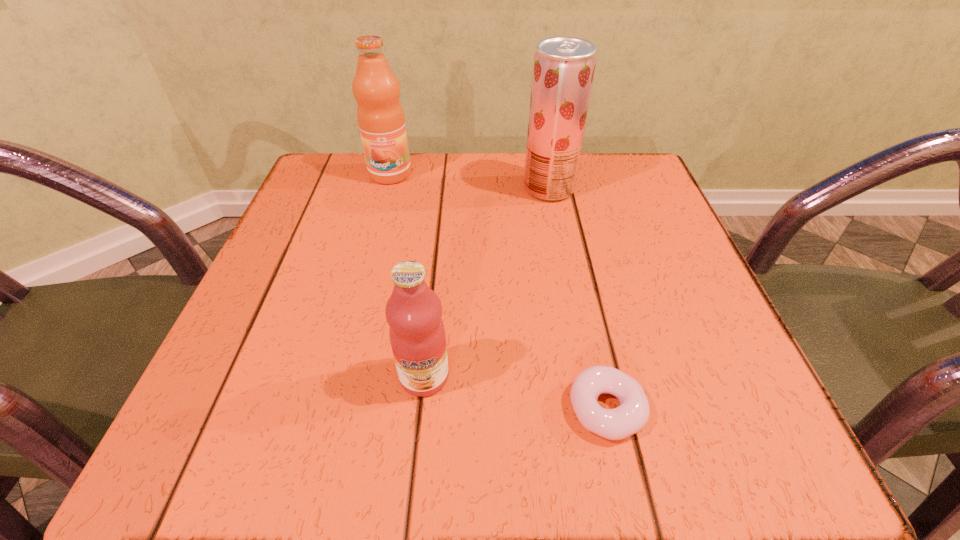
Locate which object is the second closest to the third tallest object. Please provide its 2D coordinates. Your answer should be formatted as a tuple, i.e. [(x, y)], where the tuple contains the x and y coordinates of a point satisfying the conditions above.

[(563, 68)]

At what (x,y) coordinates should I click in order to perform the action: click on object that is the closest one to the rightmost fruit juice. Please return your answer as a coordinate pair (x, y). This screenshot has height=540, width=960. Looking at the image, I should click on click(x=380, y=115).

Select which fruit juice appears as the closest to the shortest object. Please provide its 2D coordinates. Your answer should be formatted as a tuple, i.e. [(x, y)], where the tuple contains the x and y coordinates of a point satisfying the conditions above.

[(417, 334)]

Identify which fruit juice is the third closest to the shortest object. Please provide its 2D coordinates. Your answer should be formatted as a tuple, i.e. [(x, y)], where the tuple contains the x and y coordinates of a point satisfying the conditions above.

[(380, 115)]

The height and width of the screenshot is (540, 960). Identify the location of vacant space that satisfies the following two spatial constraints: 1. on the label side of the leftmost fruit juice; 2. on the right side of the rightmost fruit juice. (386, 188).

Locate an element on the screen. free spot that satisfies the following two spatial constraints: 1. on the label side of the leftmost fruit juice; 2. on the left side of the shortest object is located at coordinates coord(327,409).

Identify the location of vacant position in the image that satisfies the following two spatial constraints: 1. on the label of the third object from right to left; 2. on the left side of the shortest object. (420, 409).

Image resolution: width=960 pixels, height=540 pixels. What are the coordinates of `free space that satisfies the following two spatial constraints: 1. on the label side of the rightmost fruit juice; 2. on the left side of the leftmost object` in the screenshot? It's located at (386, 188).

You are a GUI agent. You are given a task and a screenshot of the screen. Output one action in this format:
    pyautogui.click(x=<x>, y=<y>)
    Task: Click on the free space that satisfies the following two spatial constraints: 1. on the label side of the leftmost object; 2. on the right side of the shortest object
    
    Given the screenshot: What is the action you would take?
    pyautogui.click(x=327, y=409)

Identify the location of vacant position in the image that satisfies the following two spatial constraints: 1. on the label side of the leftmost object; 2. on the right side of the rightmost fruit juice. This screenshot has height=540, width=960. (386, 188).